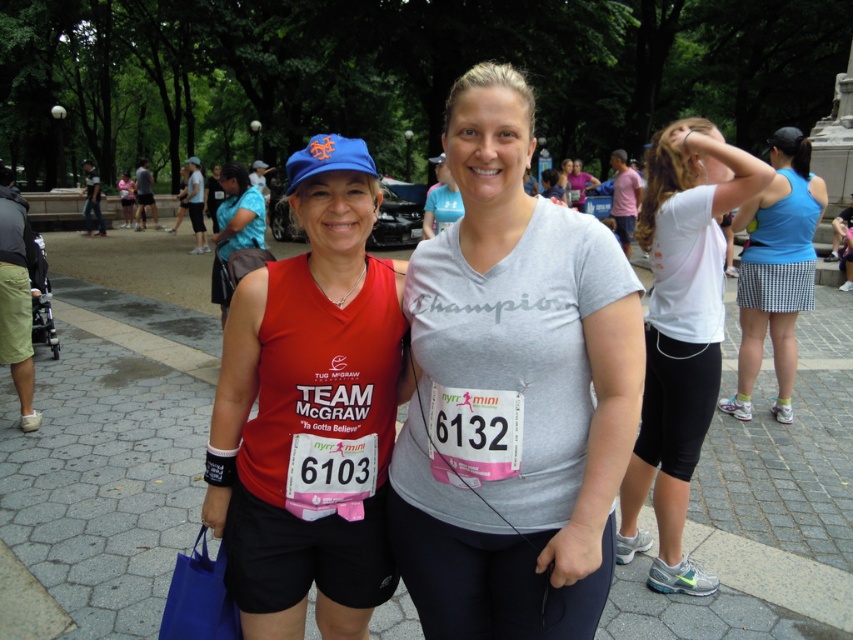
Question: Can you confirm if gray matte t-shirt at center is smaller than white matte shirt at upper right?

Choices:
 (A) yes
 (B) no

Answer: (A)

Question: Which object is closer to the camera taking this photo?

Choices:
 (A) white matte shirt at upper right
 (B) gray matte t-shirt at center

Answer: (B)

Question: Which of the following is the farthest from the observer?

Choices:
 (A) (339, 227)
 (B) (682, 288)
 (C) (218, 244)

Answer: (C)

Question: Estimate the real-world distances between objects in this image. Which object is closer to the white matte shirt at upper right?

Choices:
 (A) matte red tank top at center
 (B) blue houndstooth skirt at right

Answer: (A)

Question: Observing the image, what is the correct spatial positioning of white matte shirt at upper right in reference to matte blue cap at upper left?

Choices:
 (A) above
 (B) below

Answer: (B)

Question: From the image, what is the correct spatial relationship of gray matte t-shirt at center in relation to white matte shirt at upper right?

Choices:
 (A) left
 (B) right

Answer: (A)